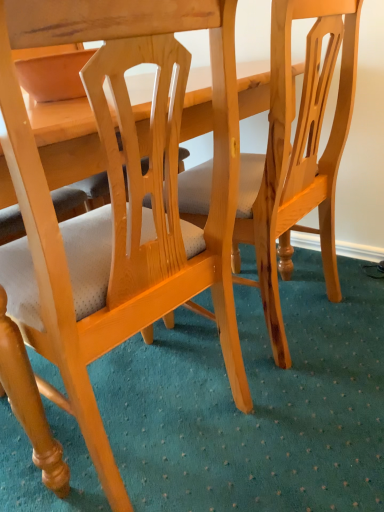
Question: Considering the positions of light brown wood chair at center, which is counted as the second chair, starting from the left, and light brown wood chair at center, which is counted as the 1th chair, starting from the left, in the image, is light brown wood chair at center, which is counted as the second chair, starting from the left, wider or thinner than light brown wood chair at center, which is counted as the 1th chair, starting from the left,?

Choices:
 (A) wide
 (B) thin

Answer: (B)

Question: Looking at the image, does light brown wood chair at center, which is counted as the second chair, starting from the left, seem bigger or smaller compared to light brown wood chair at center, which is counted as the 1th chair, starting from the left?

Choices:
 (A) big
 (B) small

Answer: (B)

Question: Relative to light brown wood chair at center, which ranks as the 2th chair in right-to-left order, is light brown wood chair at center, which is counted as the second chair, starting from the left, in front or behind?

Choices:
 (A) behind
 (B) front

Answer: (A)

Question: Is light brown wood chair at center, which ranks as the 2th chair in right-to-left order, inside the boundaries of light brown wood chair at center, which ranks as the 1th chair in right-to-left order, or outside?

Choices:
 (A) outside
 (B) inside

Answer: (A)

Question: In terms of size, does light brown wood chair at center, which is counted as the 1th chair, starting from the left, appear bigger or smaller than light brown wood chair at center, which is counted as the second chair, starting from the left?

Choices:
 (A) big
 (B) small

Answer: (A)

Question: Visually, is light brown wood chair at center, which ranks as the 2th chair in right-to-left order, positioned to the left or to the right of light brown wood chair at center, which ranks as the 1th chair in right-to-left order?

Choices:
 (A) right
 (B) left

Answer: (B)

Question: From their relative heights in the image, would you say light brown wood chair at center, which is counted as the 1th chair, starting from the left, is taller or shorter than light brown wood chair at center, which ranks as the 1th chair in right-to-left order?

Choices:
 (A) tall
 (B) short

Answer: (A)